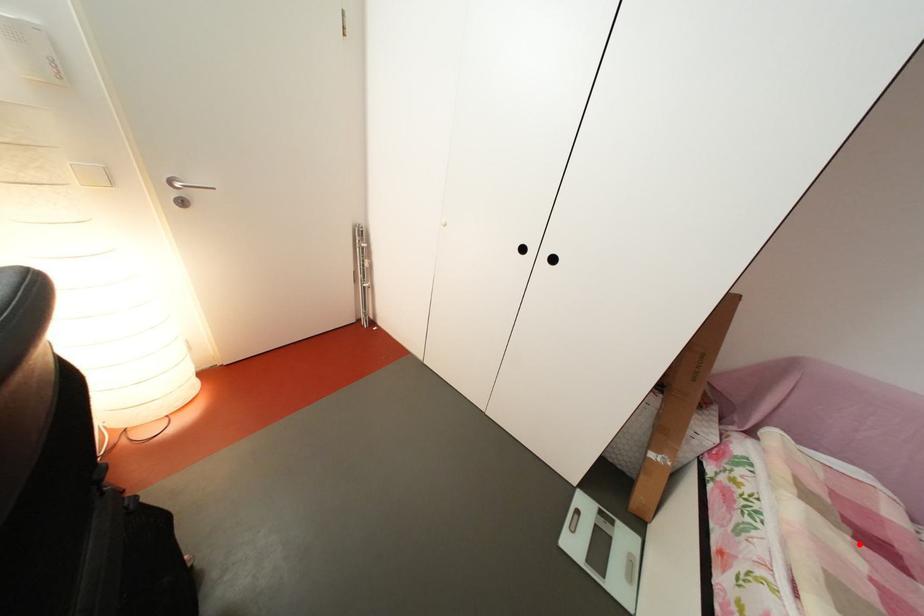
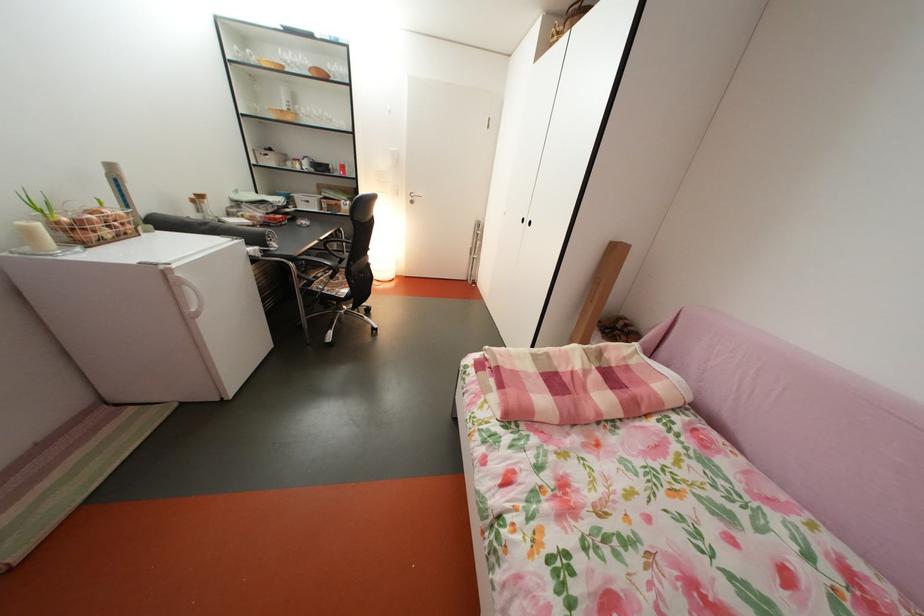
Question: I am providing you with two images of the same scene from different viewpoints. A red point is shown in image1. For the corresponding object point in image2, is it positioned nearer or farther from the camera?

Choices:
 (A) Nearer
 (B) Farther

Answer: (B)